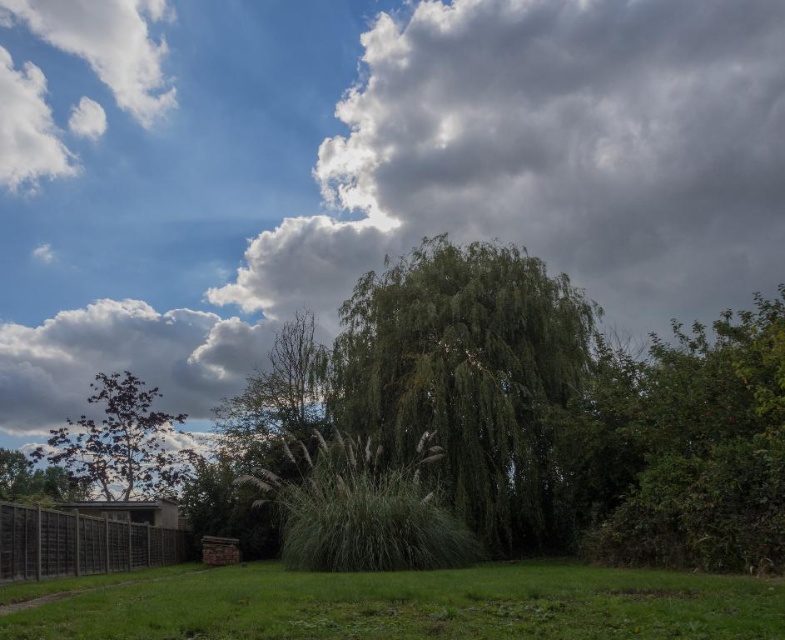
Question: Which of these objects is positioned farthest from the green leafy bush at right?

Choices:
 (A) green leafy willow at center
 (B) cloudy sky at upper center
 (C) wooden fence at lower left

Answer: (B)

Question: Which point is closer to the camera taking this photo?

Choices:
 (A) (340, 307)
 (B) (162, 488)

Answer: (A)

Question: Can you confirm if cloudy sky at upper center is positioned to the right of wooden fence at lower left?

Choices:
 (A) yes
 (B) no

Answer: (A)

Question: Estimate the real-world distances between objects in this image. Which object is closer to the green grassy at lower center?

Choices:
 (A) white fluffy cloud at upper left
 (B) green leafy bush at right
 (C) dark green leafy tree at left
 (D) cloudy sky at upper center

Answer: (B)

Question: Does cloudy sky at upper center appear over white fluffy cloud at upper left?

Choices:
 (A) yes
 (B) no

Answer: (B)

Question: Is dark green leafy tree at left to the left of wooden fence at lower left from the viewer's perspective?

Choices:
 (A) yes
 (B) no

Answer: (A)